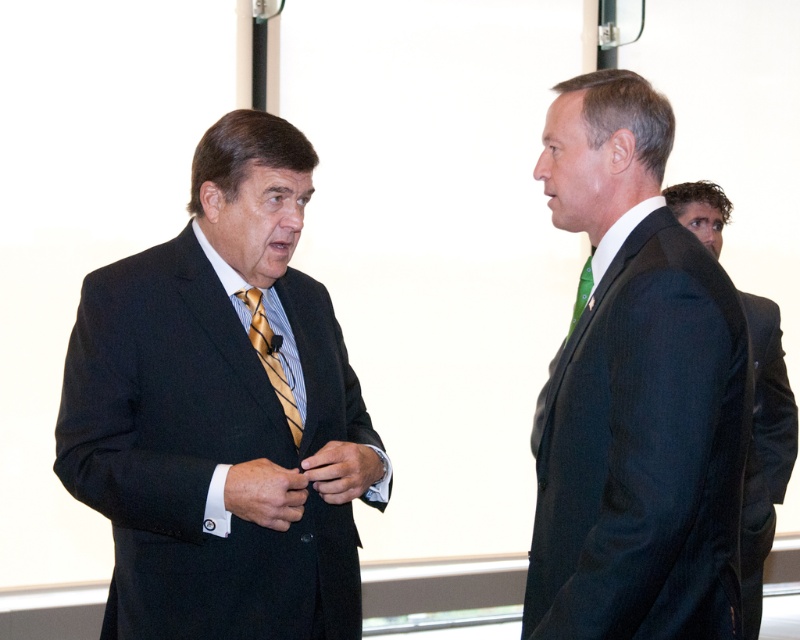
Question: Which object appears closest to the camera in this image?

Choices:
 (A) green silk tie at right
 (B) dark gray suit at right

Answer: (A)

Question: Is dark gray suit at right above yellow striped tie at left?

Choices:
 (A) yes
 (B) no

Answer: (B)

Question: Which of the following is the closest to the observer?

Choices:
 (A) black wool suit at right
 (B) matte black suit at left

Answer: (B)

Question: Observing the image, what is the correct spatial positioning of black wool suit at right in reference to green silk tie at right?

Choices:
 (A) above
 (B) below

Answer: (B)

Question: Which point is farther to the camera?

Choices:
 (A) matte black suit at left
 (B) dark gray suit at right

Answer: (B)

Question: Is the position of dark gray suit at right more distant than that of green silk tie at right?

Choices:
 (A) no
 (B) yes

Answer: (B)